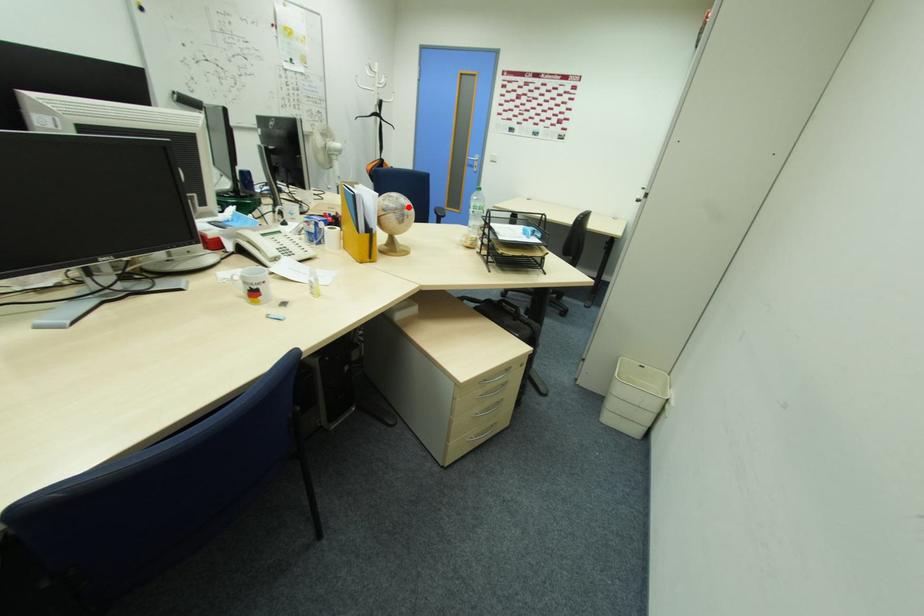
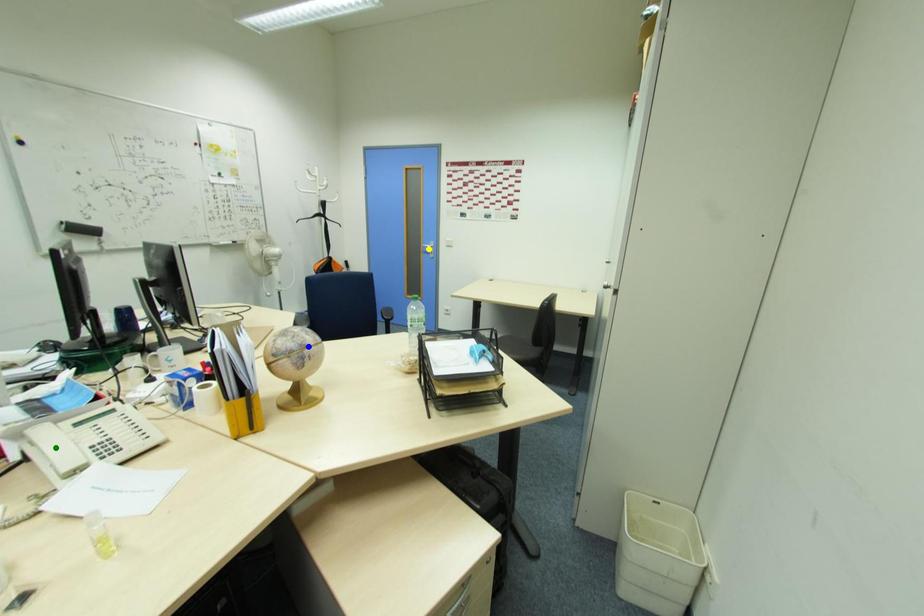
Question: I am providing you with two images of the same scene from different viewpoints. A red point is marked on the first image. You are given multiple points on the second image. Which mark in image 2 goes with the point in image 1?

Choices:
 (A) blue point
 (B) yellow point
 (C) green point

Answer: (A)